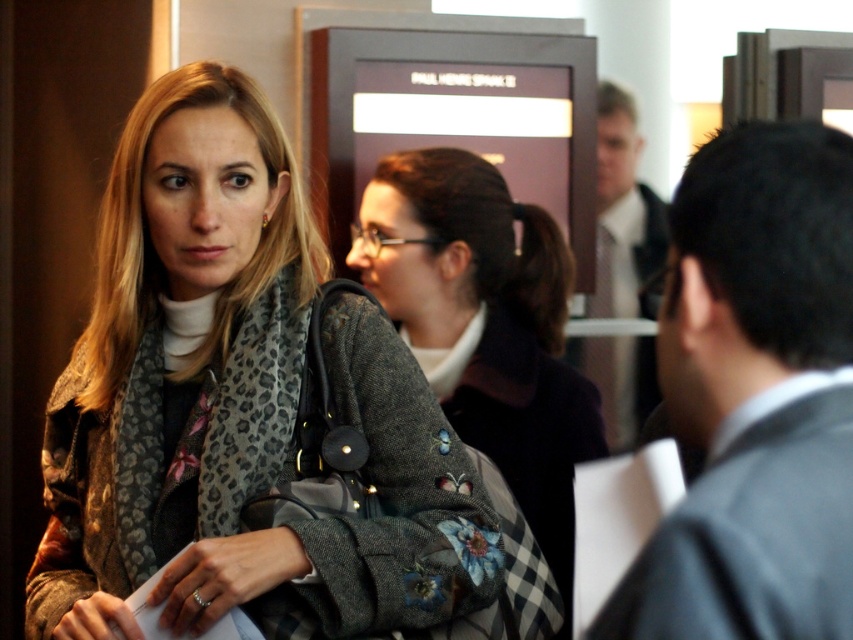
Based on the coordinates provided, which item is located at point (236, 401) in the image?

The point (236, 401) indicates the leopard print coat at center.

Based on the scene description, which object is positioned lower in the image, the leopard print coat at center or the light brown suit at upper right?

The leopard print coat at center is positioned below the light brown suit at upper right, so the leopard print coat at center is lower in the image.